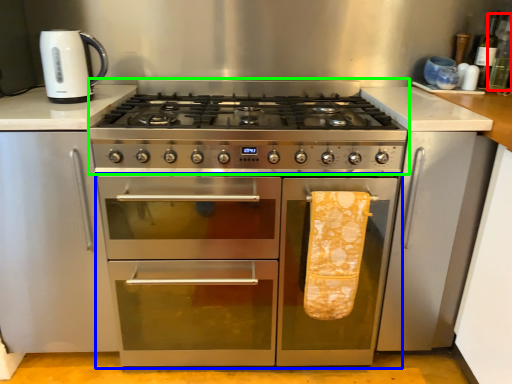
Question: Which object is the closest to the bottle (highlighted by a red box)? Choose among these: oven (highlighted by a blue box) or gas stove (highlighted by a green box).

Choices:
 (A) oven
 (B) gas stove

Answer: (B)